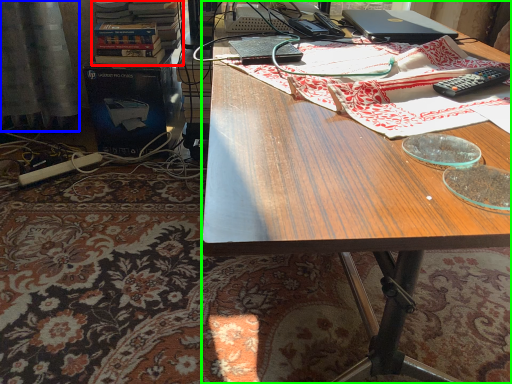
Question: Based on their relative distances, which object is nearer to book (highlighted by a red box)? Choose from curtain (highlighted by a blue box) and desk (highlighted by a green box).

Choices:
 (A) curtain
 (B) desk

Answer: (A)